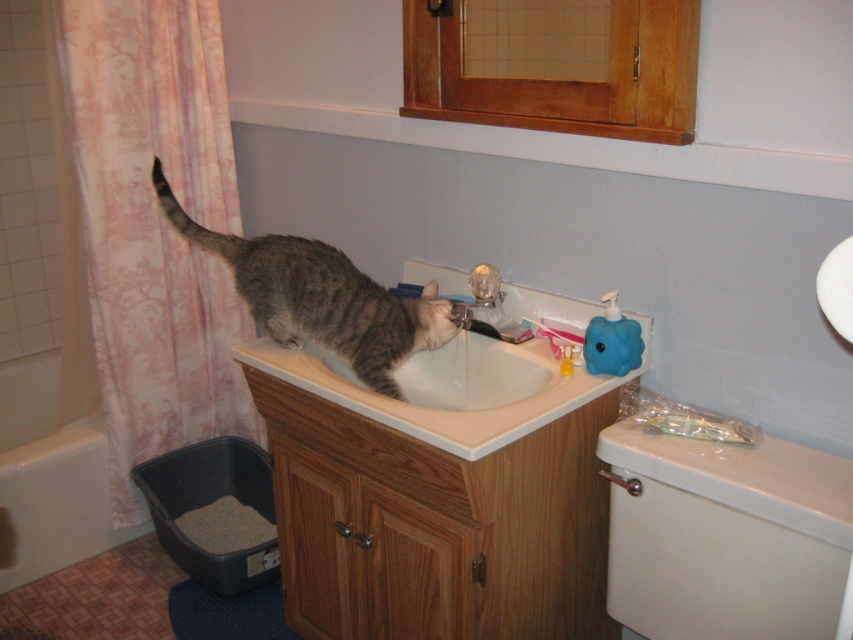
Between gray tabby cat at sink and matte silver faucet at sink center, which one is positioned lower?

matte silver faucet at sink center is below.

Measure the distance between point (x=343, y=301) and camera.

Point (x=343, y=301) and camera are 5.51 feet apart.

Find the location of `gray tabby cat at sink`. gray tabby cat at sink is located at coordinates (321, 298).

Is point (42, 547) positioned behind point (474, 294)?

Yes, it is.

Can you confirm if white glossy bathtub at lower left is shorter than matte silver faucet at sink center?

No, white glossy bathtub at lower left is not shorter than matte silver faucet at sink center.

Between point (114, 532) and point (492, 275), which one is positioned in front?

Point (492, 275)

This screenshot has height=640, width=853. Identify the location of white glossy bathtub at lower left. (49, 477).

Does white glossy sink at center appear under white glossy bathtub at lower left?

No.

Does white glossy sink at center have a larger size compared to white glossy bathtub at lower left?

Yes.

Is point (492, 433) less distant than point (79, 458)?

Yes.

Where is `white glossy sink at center`? white glossy sink at center is located at coordinates (451, 387).